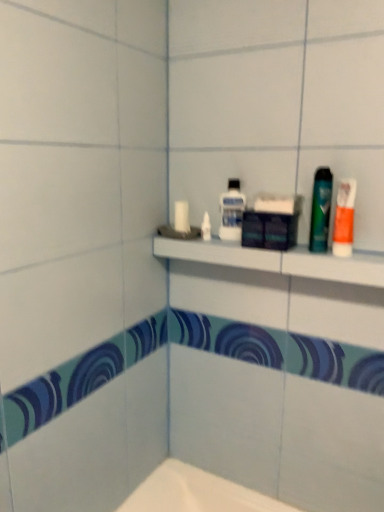
Question: Are clear plastic mouthwash at upper center, marked as the 1th mouthwash in a back-to-front arrangement, and orange matte toothpaste at right far apart?

Choices:
 (A) no
 (B) yes

Answer: (A)

Question: From a real-world perspective, is clear plastic mouthwash at upper center, positioned as the first mouthwash in left-to-right order, physically below orange matte toothpaste at right?

Choices:
 (A) no
 (B) yes

Answer: (A)

Question: Does clear plastic mouthwash at upper center, marked as the 1th mouthwash in a back-to-front arrangement, have a lesser height compared to orange matte toothpaste at right?

Choices:
 (A) no
 (B) yes

Answer: (B)

Question: From the image's perspective, is clear plastic mouthwash at upper center, marked as the 1th mouthwash in a back-to-front arrangement, located above orange matte toothpaste at right?

Choices:
 (A) no
 (B) yes

Answer: (B)

Question: Is the depth of clear plastic mouthwash at upper center, marked as the 1th mouthwash in a back-to-front arrangement, less than that of orange matte toothpaste at right?

Choices:
 (A) yes
 (B) no

Answer: (B)

Question: Can you confirm if clear plastic mouthwash at upper center, marked as the 1th mouthwash in a back-to-front arrangement, is smaller than orange matte toothpaste at right?

Choices:
 (A) no
 (B) yes

Answer: (A)

Question: Is white plastic shelf at upper center touching green glossy mouthwash at right, which ranks as the 1th mouthwash in right-to-left order?

Choices:
 (A) no
 (B) yes

Answer: (A)

Question: Considering the relative sizes of white plastic shelf at upper center and green glossy mouthwash at right, which is counted as the first mouthwash, starting from the front, in the image provided, is white plastic shelf at upper center thinner than green glossy mouthwash at right, which is counted as the first mouthwash, starting from the front,?

Choices:
 (A) yes
 (B) no

Answer: (B)

Question: From the image's perspective, is white plastic shelf at upper center below green glossy mouthwash at right, which ranks as the 1th mouthwash in right-to-left order?

Choices:
 (A) yes
 (B) no

Answer: (A)

Question: Is white plastic shelf at upper center wider than green glossy mouthwash at right, which ranks as the 1th mouthwash in right-to-left order?

Choices:
 (A) no
 (B) yes

Answer: (B)

Question: Is there a large distance between white plastic shelf at upper center and green glossy mouthwash at right, which is counted as the first mouthwash, starting from the front?

Choices:
 (A) no
 (B) yes

Answer: (A)

Question: From the image's perspective, is white plastic shelf at upper center over green glossy mouthwash at right, which is counted as the first mouthwash, starting from the front?

Choices:
 (A) no
 (B) yes

Answer: (A)

Question: From the image's perspective, is white plastic shelf at upper center located above clear plastic mouthwash at upper center, marked as the 1th mouthwash in a back-to-front arrangement?

Choices:
 (A) no
 (B) yes

Answer: (A)